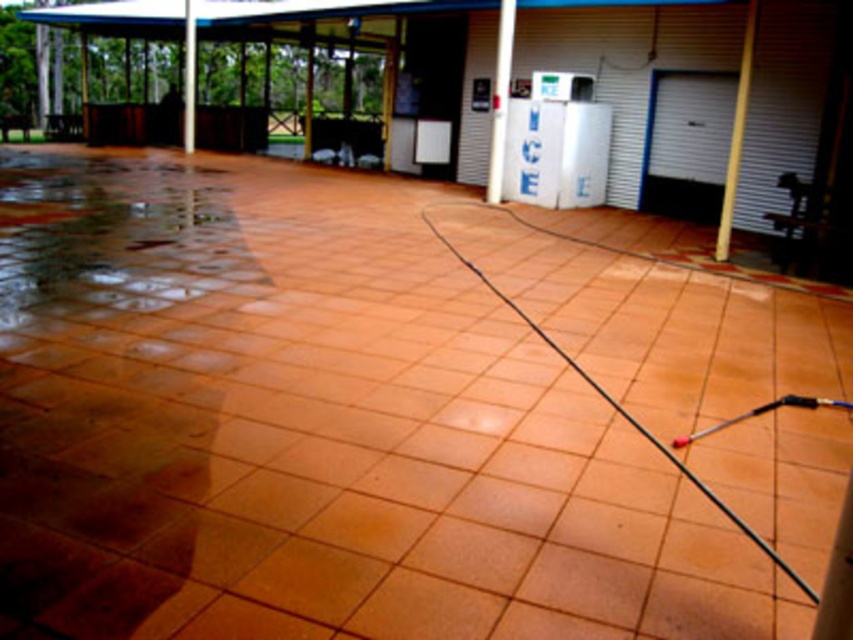
Image resolution: width=853 pixels, height=640 pixels. What do you see at coordinates (735, 132) in the screenshot?
I see `wooden pole at right` at bounding box center [735, 132].

Does wooden pole at right appear over white glossy pole at upper center?

Incorrect, wooden pole at right is not positioned above white glossy pole at upper center.

What do you see at coordinates (735, 132) in the screenshot? The image size is (853, 640). I see `wooden pole at right` at bounding box center [735, 132].

I want to click on wooden pole at right, so click(735, 132).

Consider the image. Can you confirm if smooth concrete garage at center is taller than white smooth pillar at upper left?

Indeed, smooth concrete garage at center has a greater height compared to white smooth pillar at upper left.

Does point (689, 131) lie behind point (190, 60)?

No, it is not.

What are the coordinates of `smooth concrete garage at center` in the screenshot? It's located at pyautogui.click(x=717, y=109).

Where is `smooth concrete garage at center`? The height and width of the screenshot is (640, 853). smooth concrete garage at center is located at coordinates (717, 109).

Can you confirm if wooden pole at right is bigger than white smooth pillar at upper left?

No.

Is point (752, 33) positioned after point (193, 68)?

No, it is in front of (193, 68).

Which is in front, point (757, 10) or point (189, 124)?

Point (757, 10) is more forward.

Identify the location of wooden pole at right. (735, 132).